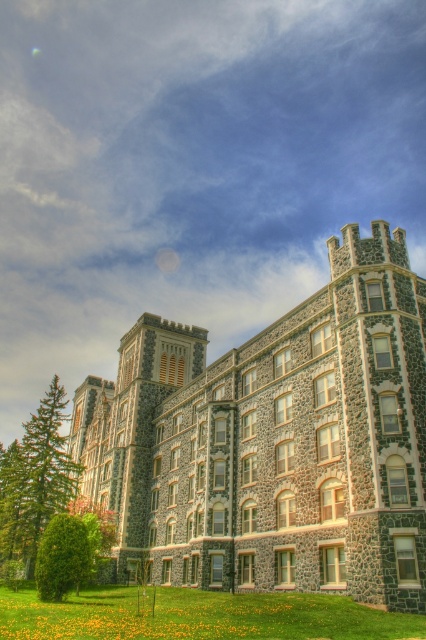
Which is below, green textured pine tree at left or green leafy tree at lower left?

green textured pine tree at left is lower down.

Is green textured pine tree at left shorter than green leafy tree at lower left?

No, green textured pine tree at left is not shorter than green leafy tree at lower left.

At what (x,y) coordinates should I click in order to perform the action: click on green textured pine tree at left. Please return your answer as a coordinate pair (x, y). The width and height of the screenshot is (426, 640). Looking at the image, I should click on (34, 480).

Can you confirm if green grass at lower center is positioned above green leafy tree at lower left?

No, green grass at lower center is not above green leafy tree at lower left.

I want to click on green grass at lower center, so click(198, 616).

Does point (327, 602) lie behind point (39, 429)?

No, it is in front of (39, 429).

Is green grass at lower center above green textured pine tree at left?

Indeed, green grass at lower center is positioned over green textured pine tree at left.

Where is `green grass at lower center`? The width and height of the screenshot is (426, 640). green grass at lower center is located at coordinates (198, 616).